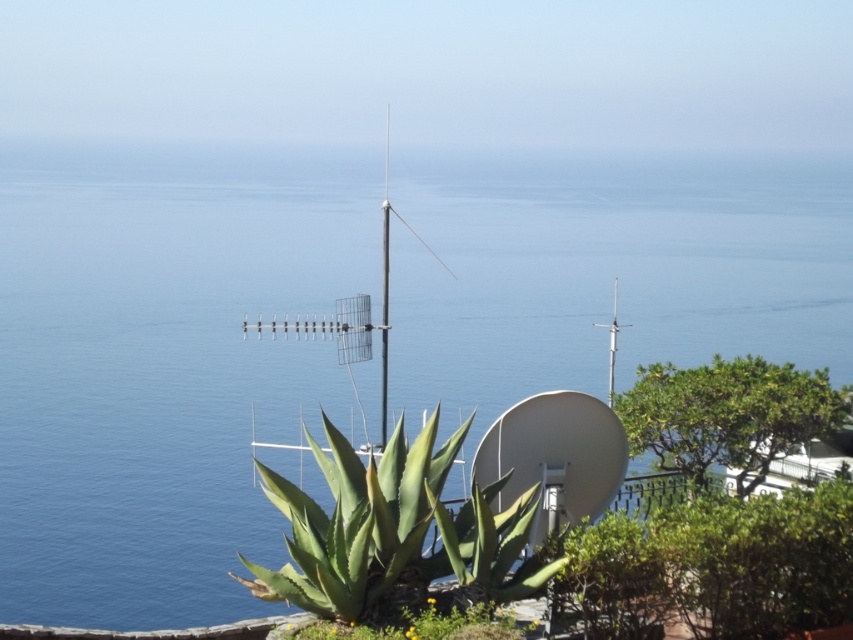
Question: Estimate the real-world distances between objects in this image. Which object is closer to the metallic silver antenna at center?

Choices:
 (A) green leafy bush at lower right
 (B) green leafy bush at right
 (C) green leafy plant at center
 (D) green leafy plant at lower center

Answer: (B)

Question: Estimate the real-world distances between objects in this image. Which object is closer to the green leafy plant at lower center?

Choices:
 (A) green leafy bush at right
 (B) metallic silver antenna at center
 (C) green leafy plant at center

Answer: (C)

Question: Is green leafy plant at lower center thinner than metallic silver antenna at center?

Choices:
 (A) yes
 (B) no

Answer: (A)

Question: Is green leafy plant at lower center positioned behind metallic silver antenna at center?

Choices:
 (A) no
 (B) yes

Answer: (A)

Question: Considering the relative positions of green leafy plant at center and metallic silver antenna at center in the image provided, where is green leafy plant at center located with respect to metallic silver antenna at center?

Choices:
 (A) left
 (B) right

Answer: (A)

Question: Based on their relative distances, which object is nearer to the green leafy plant at lower center?

Choices:
 (A) metallic silver antenna at center
 (B) green leafy bush at lower right
 (C) green leafy bush at right

Answer: (B)